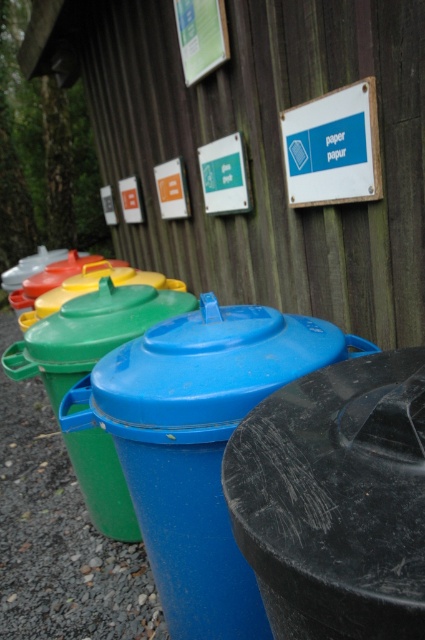
Which is below, blue plastic bin at center or blue plastic sign at upper center?

blue plastic bin at center is lower down.

Looking at this image, is blue plastic bin at center to the right of blue plastic sign at upper center from the viewer's perspective?

Incorrect, blue plastic bin at center is not on the right side of blue plastic sign at upper center.

Locate an element on the screen. This screenshot has height=640, width=425. blue plastic bin at center is located at coordinates (59, 531).

Is point (59, 584) closer to viewer compared to point (99, 284)?

Yes, it is in front of point (99, 284).

Which is more to the right, blue plastic bin at center or green matte lid at center?

From the viewer's perspective, green matte lid at center appears more on the right side.

Between point (0, 612) and point (71, 333), which one is positioned behind?

Point (0, 612)

This screenshot has height=640, width=425. I want to click on blue plastic bin at center, so click(x=59, y=531).

Who is lower down, blue plastic sign at upper center or green matte lid at center?

green matte lid at center is lower down.

At what (x,y) coordinates should I click in order to perform the action: click on blue plastic sign at upper center. Please return your answer as a coordinate pair (x, y). This screenshot has height=640, width=425. Looking at the image, I should click on (333, 147).

Where is `blue plastic sign at upper center`? The height and width of the screenshot is (640, 425). blue plastic sign at upper center is located at coordinates (333, 147).